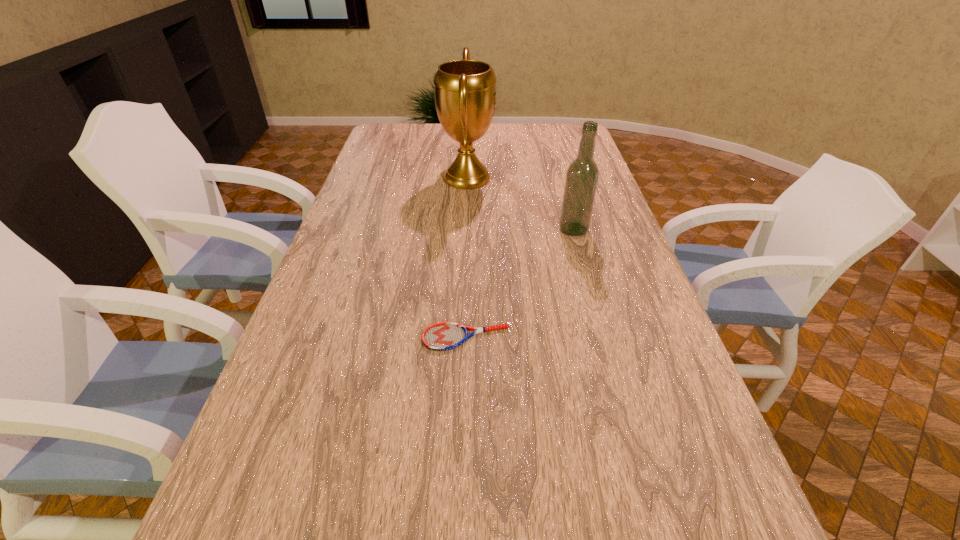
The height and width of the screenshot is (540, 960). Find the location of `vacant point at the far edge`. vacant point at the far edge is located at coordinates (526, 131).

Find the location of `vacant area at the left edge`. vacant area at the left edge is located at coordinates (322, 293).

This screenshot has width=960, height=540. In the image, there is a desktop. In order to click on vacant space at the right edge in this screenshot , I will do `click(614, 224)`.

This screenshot has width=960, height=540. What are the coordinates of `vacant area that lies between the tallest object and the second shortest object` in the screenshot? It's located at pyautogui.click(x=520, y=204).

Identify the location of free space between the second shortest object and the shortest object. This screenshot has height=540, width=960. (519, 284).

Image resolution: width=960 pixels, height=540 pixels. In order to click on free spot between the shortest object and the liquor in this screenshot , I will do `click(519, 284)`.

The height and width of the screenshot is (540, 960). I want to click on vacant space that's between the shortest object and the second farthest object, so click(x=519, y=284).

This screenshot has width=960, height=540. I want to click on unoccupied position between the shortest object and the trophy cup, so click(467, 258).

At what (x,y) coordinates should I click in order to perform the action: click on free space between the second nearest object and the farthest object. Please return your answer as a coordinate pair (x, y). Looking at the image, I should click on (520, 204).

The height and width of the screenshot is (540, 960). I want to click on vacant point located between the tennis racket and the second farthest object, so click(519, 284).